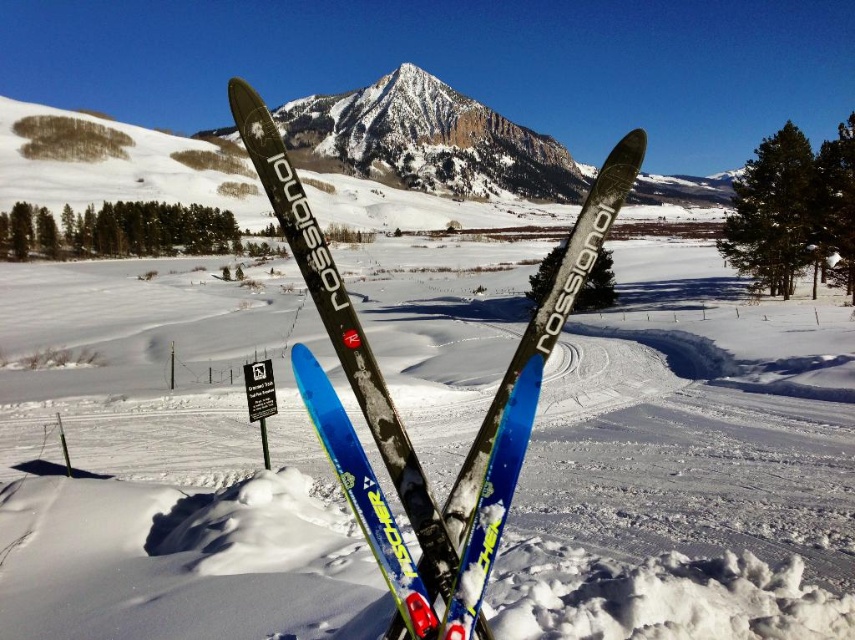
You are planning to take a photo of the blue glossy fischer skis at center and the snowy granite peak at center. Which object should be placed closer to the camera to ensure both are in focus?

The blue glossy fischer skis at center has a lesser height compared to snowy granite peak at center, so to ensure both are in focus, the blue glossy fischer skis at center should be placed closer to the camera.

You are planning to carry both the blue glossy fischer skis at center and the snowy granite peak at center while hiking. Which object should you choose to carry first if you can only carry one at a time due to their size?

The blue glossy fischer skis at center has a smaller size compared to the snowy granite peak at center, so you should carry the blue glossy fischer skis at center first since it is smaller and easier to handle.

You are standing at the point with coordinates (343, 330) in the winter landscape. Which object is exactly at that location?

The point at coordinates (343, 330) corresponds to the blue glossy Fischer skis at center.